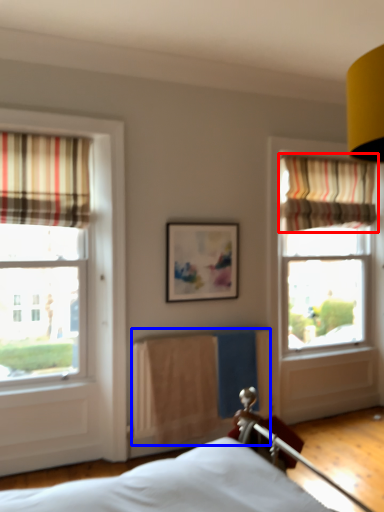
Question: Among these objects, which one is farthest to the camera, curtain (highlighted by a red box) or radiator (highlighted by a blue box)?

Choices:
 (A) curtain
 (B) radiator

Answer: (A)